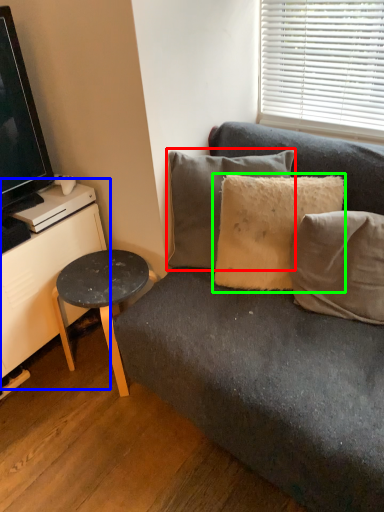
Question: Considering the real-world distances, which object is closest to pillow (highlighted by a red box)? dresser (highlighted by a blue box) or pillow (highlighted by a green box).

Choices:
 (A) dresser
 (B) pillow

Answer: (B)